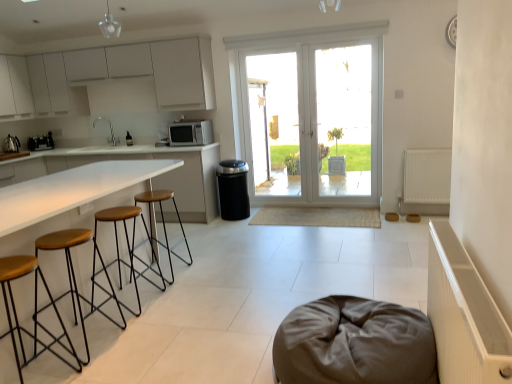
Question: Does point (456, 301) appear closer or farther from the camera than point (53, 236)?

Choices:
 (A) farther
 (B) closer

Answer: (B)

Question: Is white ribbed radiator at right, acting as the 2th radiator starting from the right, inside or outside of brown wood/black metal stool at left, marked as the 2th stool in a front-to-back arrangement?

Choices:
 (A) outside
 (B) inside

Answer: (A)

Question: Which is nearer to the satin nickel faucet at upper left?

Choices:
 (A) brushed metal kettle at left, acting as the second appliance starting from the right
 (B) white matte cabinets at upper left
 (C) matte black coffee machine at left
 (D) wooden seat at left, which is the 4th stool in back-to-front order
 (E) transparent glass door at center, the 1th window screen when ordered from left to right

Answer: (C)

Question: Which object is the closest to the white glass door at center?

Choices:
 (A) wooden seat with metal legs at left, the 2th stool viewed from the back
 (B) satin nickel faucet at upper left
 (C) matte black coffee machine at left
 (D) transparent glass door at center, the 1th window screen when ordered from left to right
 (E) transparent glass door at center, positioned as the 2th window screen in left-to-right order

Answer: (D)